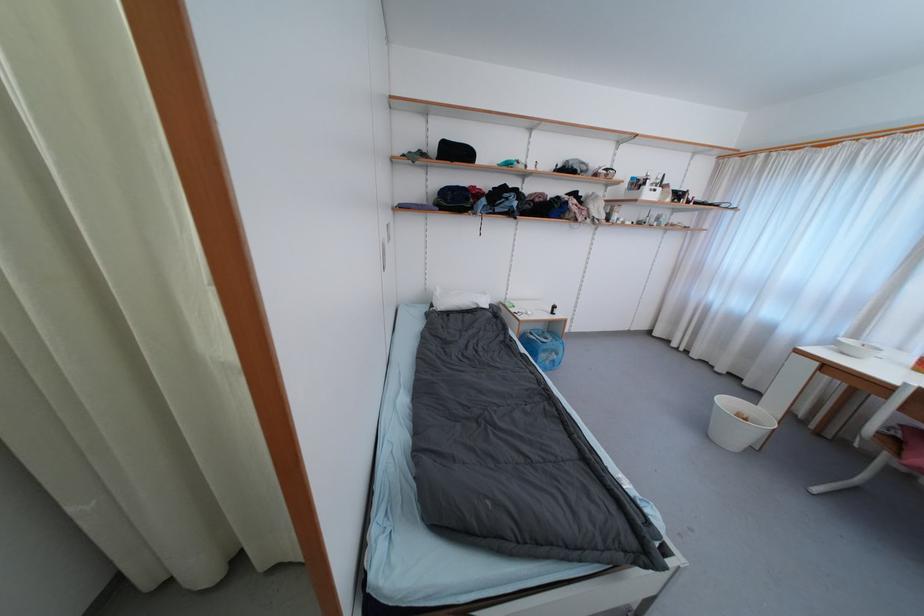
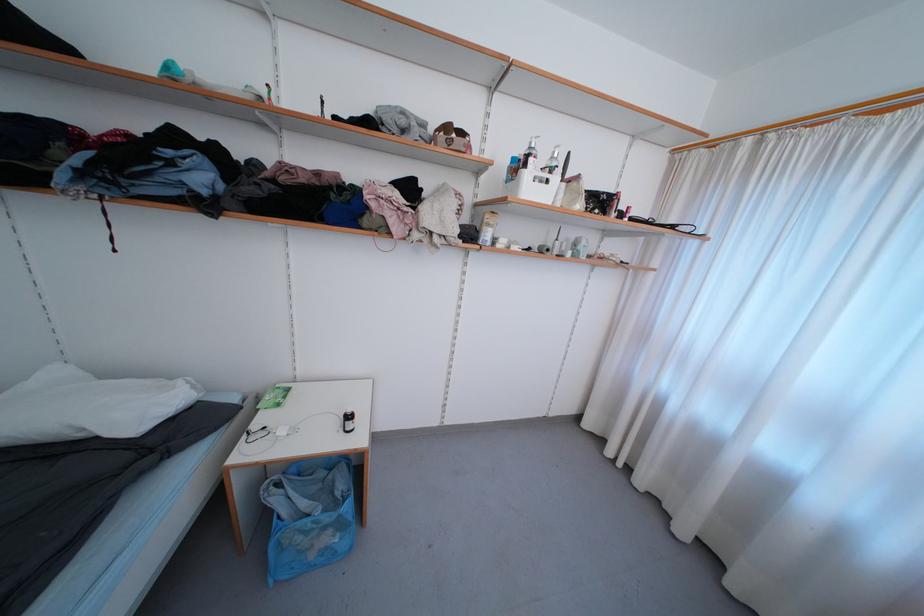
In the second image, find the point that corresponds to (649,185) in the first image.

(529, 168)